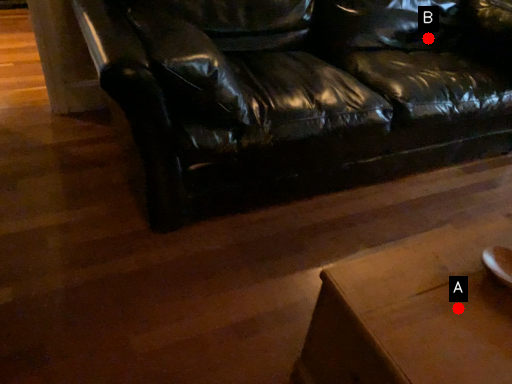
Question: Two points are circled on the image, labeled by A and B beside each circle. Among these points, which one is farthest from the camera?

Choices:
 (A) A is further
 (B) B is further

Answer: (B)